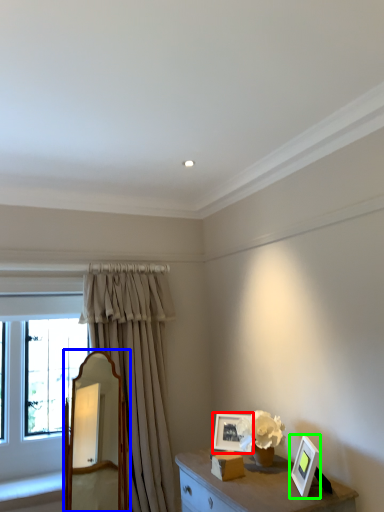
Question: Which is nearer to the picture frame (highlighted by a red box)? mirror (highlighted by a blue box) or picture frame (highlighted by a green box).

Choices:
 (A) mirror
 (B) picture frame

Answer: (B)